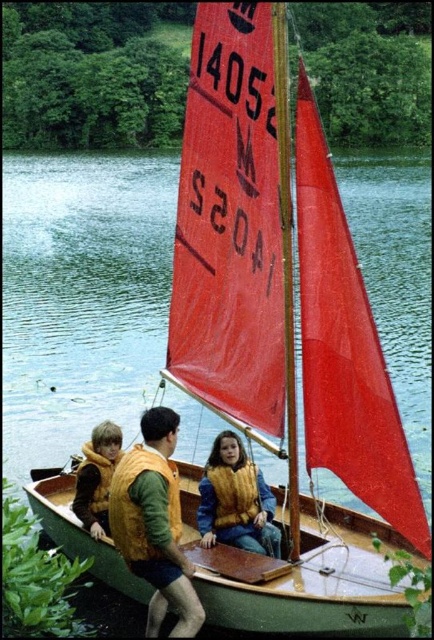
Question: Which of the following is the farthest from the observer?

Choices:
 (A) (269, 513)
 (B) (88, 461)
 (C) (372, 184)
 (D) (345, 525)

Answer: (C)

Question: In this image, where is green wood canoe at lower center located relative to orange life vest at center?

Choices:
 (A) left
 (B) right

Answer: (B)

Question: Considering the relative positions of orange life vest at center and yellow fuzzy vest at left in the image provided, where is orange life vest at center located with respect to yellow fuzzy vest at left?

Choices:
 (A) above
 (B) below

Answer: (B)

Question: Does orange life vest at center appear over yellow textured life vest at center?

Choices:
 (A) yes
 (B) no

Answer: (B)

Question: Which point is closer to the camera?

Choices:
 (A) yellow textured life vest at center
 (B) green wood canoe at lower center
 (C) green water at center
 (D) orange life vest at center

Answer: (D)

Question: Considering the real-world distances, which object is closest to the orange life vest at center?

Choices:
 (A) green water at center
 (B) yellow textured life vest at center
 (C) green wood canoe at lower center
 (D) yellow fuzzy vest at left

Answer: (C)